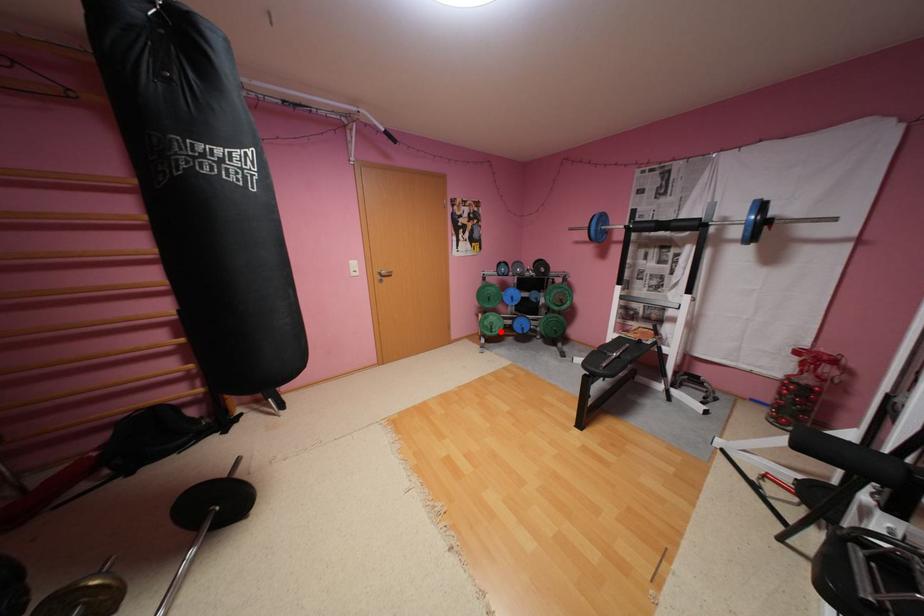
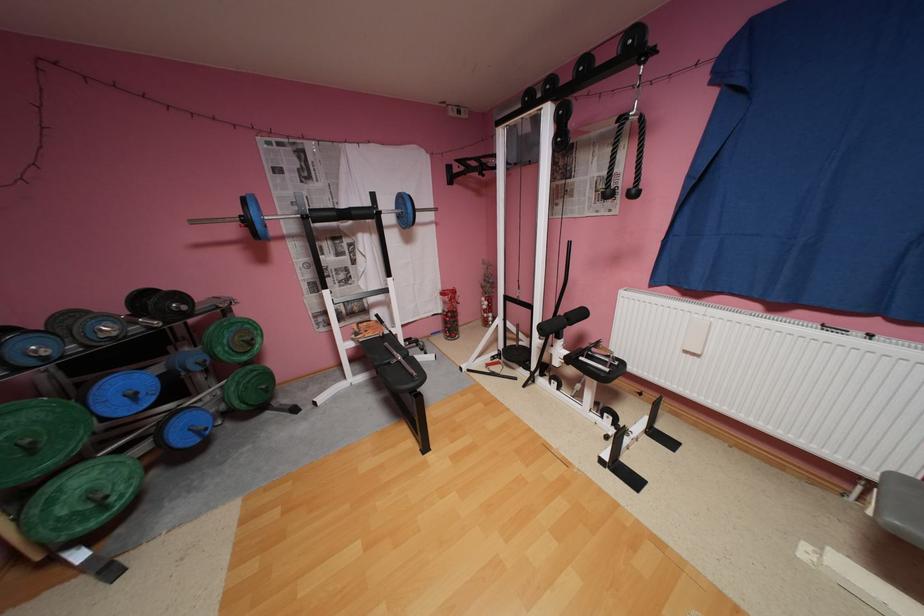
Question: I am providing you with two images of the same scene from different viewpoints. A red point is shown in image1. For the corresponding object point in image2, is it positioned nearer or farther from the camera?

Choices:
 (A) Nearer
 (B) Farther

Answer: (A)